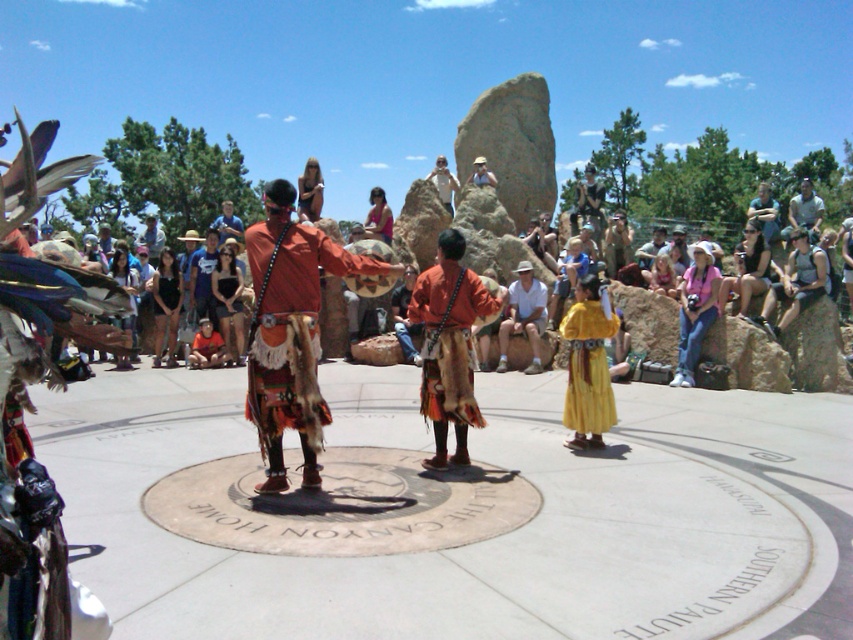
Looking at this image, does pink fabric dress at center lie behind matte pink dress at center?

No, pink fabric dress at center is closer to the viewer.

The width and height of the screenshot is (853, 640). What do you see at coordinates (695, 312) in the screenshot?
I see `pink fabric dress at center` at bounding box center [695, 312].

Find the location of a particular element. Image resolution: width=853 pixels, height=640 pixels. pink fabric dress at center is located at coordinates (695, 312).

Is orange leather outfit at center smaller than light brown leather hat at center?

Actually, orange leather outfit at center might be larger than light brown leather hat at center.

Which is above, orange leather outfit at center or light brown leather hat at center?

light brown leather hat at center is higher up.

Does point (277, 198) come closer to viewer compared to point (486, 173)?

Yes, it is.

The image size is (853, 640). I want to click on orange leather outfit at center, so click(289, 330).

Is white cotton shirt at center closer to the viewer compared to matte pink dress at center?

Yes, it is.

Does white cotton shirt at center have a larger size compared to matte pink dress at center?

Indeed, white cotton shirt at center has a larger size compared to matte pink dress at center.

At what (x,y) coordinates should I click in order to perform the action: click on white cotton shirt at center. Please return your answer as a coordinate pair (x, y). Looking at the image, I should click on (524, 316).

Locate an element on the screen. Image resolution: width=853 pixels, height=640 pixels. white cotton shirt at center is located at coordinates pos(524,316).